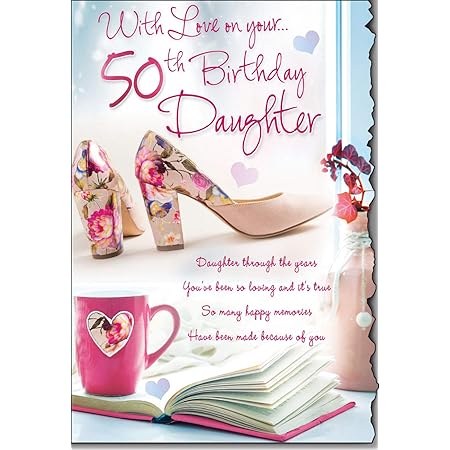
This screenshot has width=450, height=450. In order to click on pink cover on book in this screenshot , I will do `click(197, 420)`.